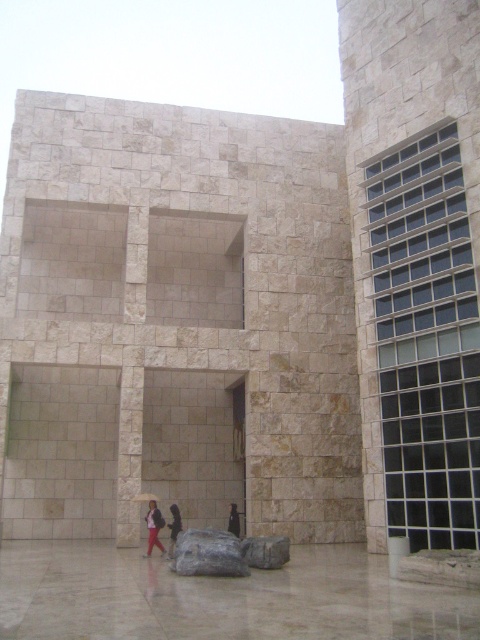
You are standing in front of the modern architectural structure. You need to locate the dark gray fabric umbrella at lower center. Where is it located in terms of coordinates?

The dark gray fabric umbrella at lower center is located at coordinates point (154,528).

You are standing in front of the modern architectural structure. You see a dark fabric umbrella at lower center and a dark gray fabric jacket at center. Which object is nearer to you?

The dark fabric umbrella at lower center is closer to the viewer than the dark gray fabric jacket at center.